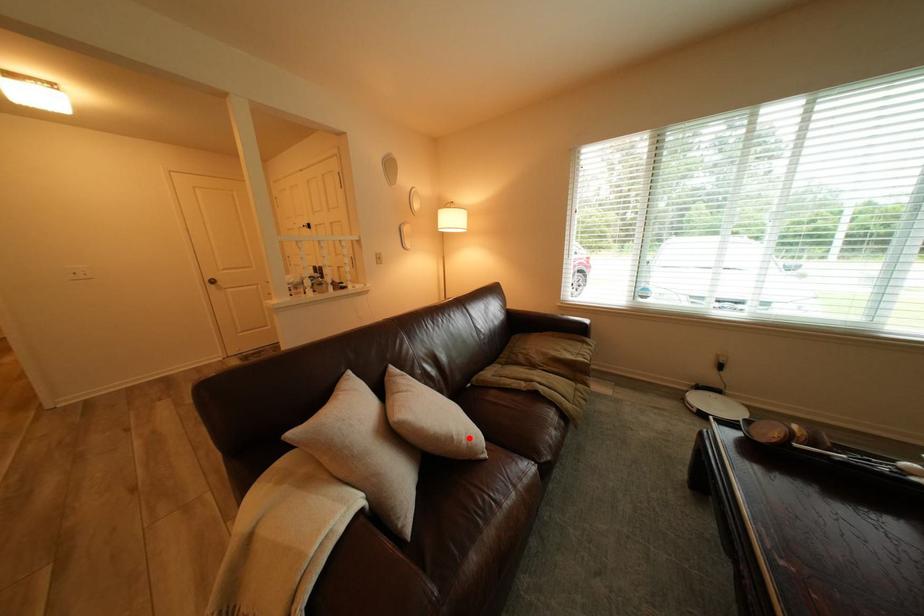
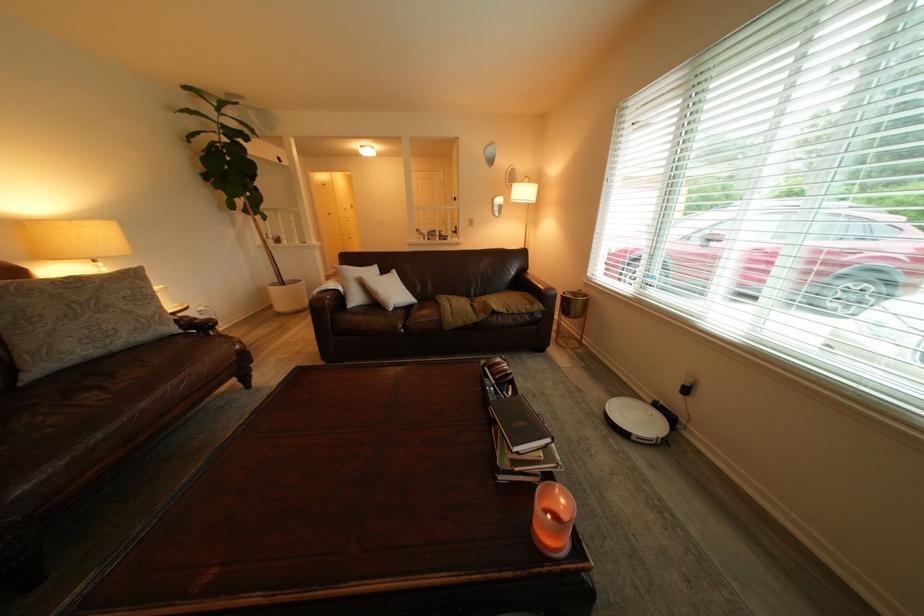
Locate, in the second image, the point that corresponds to the highlighted location in the first image.

(393, 294)